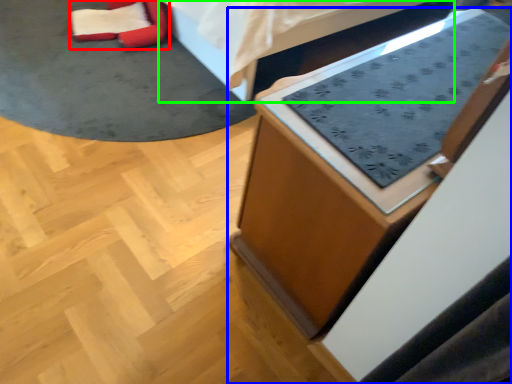
Question: Which object is the closest to the bean bag chair (highlighted by a red box)? Choose among these: furniture (highlighted by a blue box) or furniture (highlighted by a green box).

Choices:
 (A) furniture
 (B) furniture

Answer: (B)